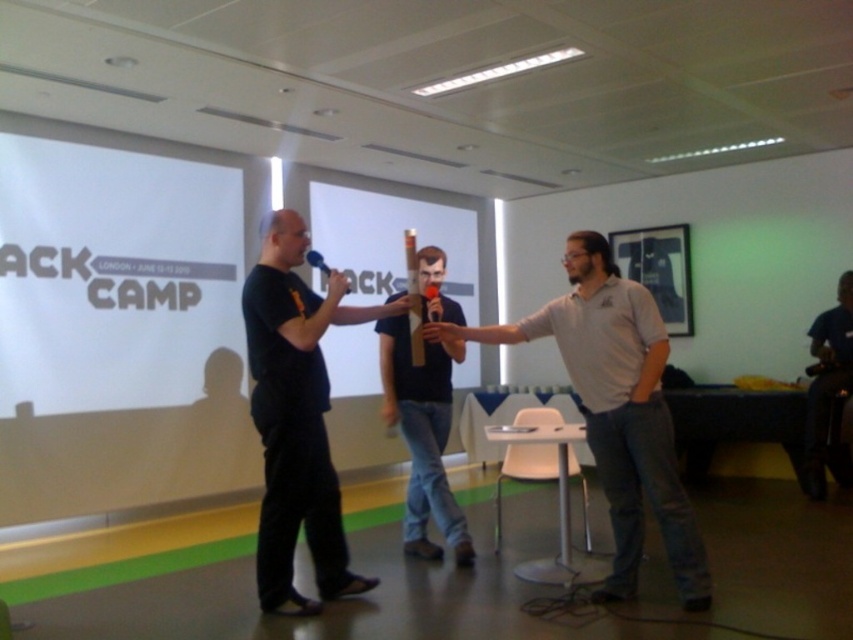
Question: Among these objects, which one is farthest from the camera?

Choices:
 (A) black matte shirt at center
 (B) black matte t-shirt at center
 (C) gray cotton shirt at center

Answer: (B)

Question: Considering the relative positions of black matte shirt at center and black matte t-shirt at center in the image provided, where is black matte shirt at center located with respect to black matte t-shirt at center?

Choices:
 (A) above
 (B) below

Answer: (A)

Question: Which of the following is the farthest from the observer?

Choices:
 (A) black matte t-shirt at center
 (B) gray cotton shirt at center

Answer: (A)

Question: Does black matte shirt at center have a greater width compared to black matte t-shirt at center?

Choices:
 (A) yes
 (B) no

Answer: (A)

Question: Can you confirm if gray cotton shirt at center is positioned below black matte shirt at center?

Choices:
 (A) no
 (B) yes

Answer: (B)

Question: Which of the following is the closest to the observer?

Choices:
 (A) gray cotton shirt at center
 (B) black matte t-shirt at center

Answer: (A)